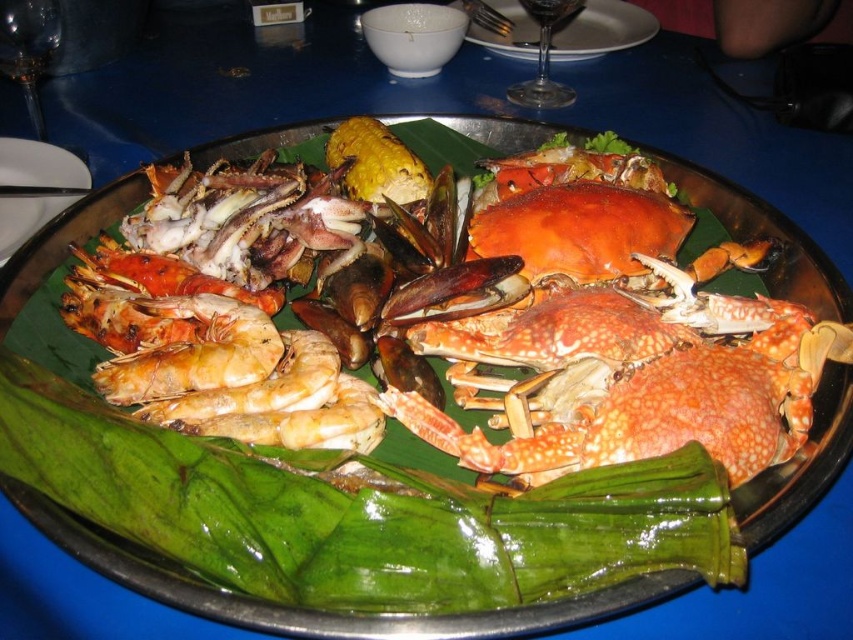
Question: Which of the following is the farthest from the observer?

Choices:
 (A) transparent glass at upper left
 (B) white glossy plate at upper left
 (C) white matte shrimp at center
 (D) white porcelain plate at upper center

Answer: (D)

Question: Does transparent glass at upper left come behind transparent glass wine glass at upper right?

Choices:
 (A) no
 (B) yes

Answer: (A)

Question: Is white matte shrimp at center thinner than white glossy plate at upper left?

Choices:
 (A) no
 (B) yes

Answer: (B)

Question: Does green leafy vegetable at center have a greater width compared to white porcelain plate at upper center?

Choices:
 (A) yes
 (B) no

Answer: (A)

Question: Which of the following is the closest to the observer?

Choices:
 (A) green leafy vegetable at center
 (B) transparent glass at upper left

Answer: (A)

Question: Which point appears closest to the camera in this image?

Choices:
 (A) (33, 198)
 (B) (527, 93)
 (C) (198, 394)
 (D) (440, 600)

Answer: (D)